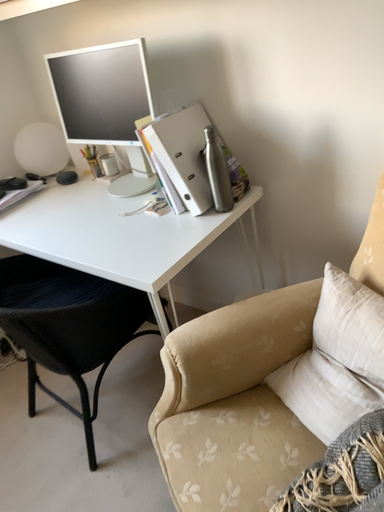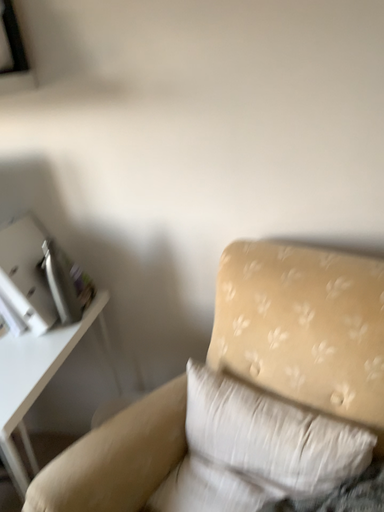
Question: Which way did the camera rotate in the video?

Choices:
 (A) rotated upward
 (B) rotated downward

Answer: (A)